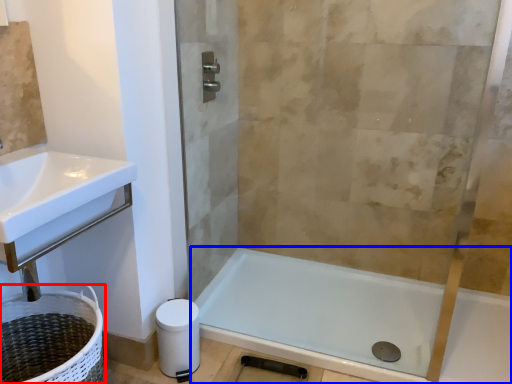
Question: Which object appears farthest to the camera in this image, laundry basket (highlighted by a red box) or bathtub (highlighted by a blue box)?

Choices:
 (A) laundry basket
 (B) bathtub

Answer: (B)